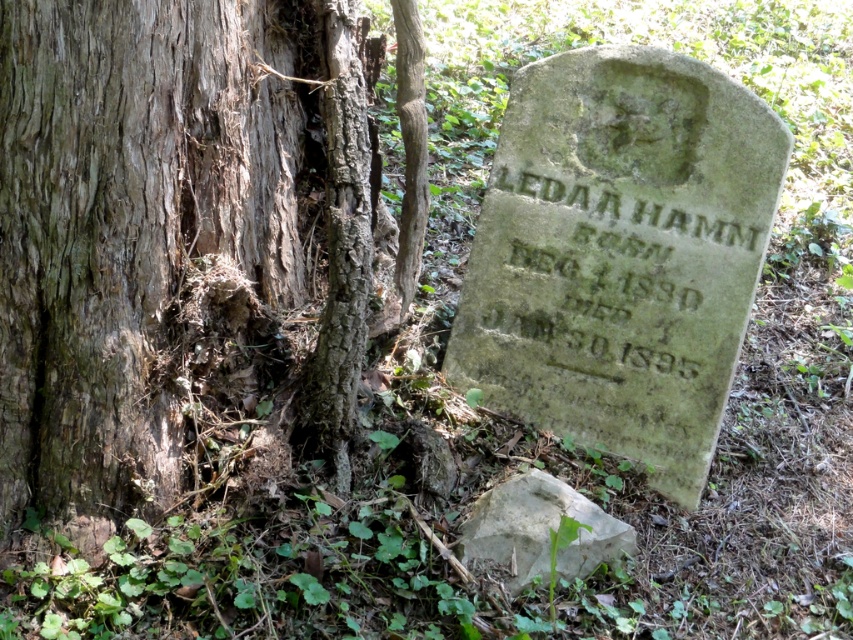
Is point (264, 220) behind point (631, 529)?

Yes, point (264, 220) is behind point (631, 529).

Which is below, brown rough bark tree trunk at left or white rough rock at lower center?

white rough rock at lower center is below.

Find the location of a particular element. brown rough bark tree trunk at left is located at coordinates (136, 225).